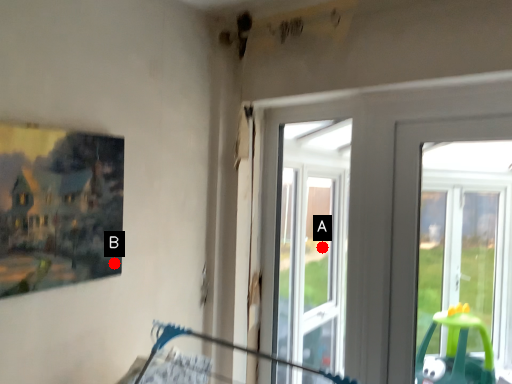
Question: Two points are circled on the image, labeled by A and B beside each circle. Which point is closer to the camera?

Choices:
 (A) A is closer
 (B) B is closer

Answer: (B)